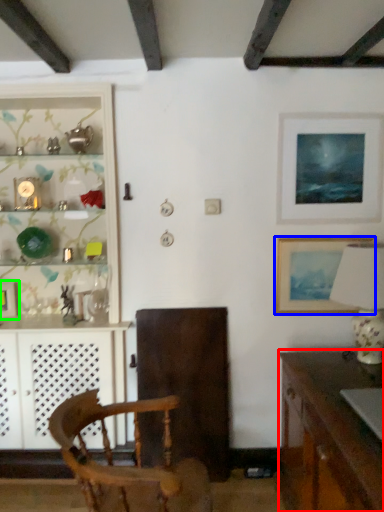
Question: Which object is the closest to the desk (highlighted by a red box)? Choose among these: picture frame (highlighted by a blue box) or picture frame (highlighted by a green box).

Choices:
 (A) picture frame
 (B) picture frame

Answer: (A)